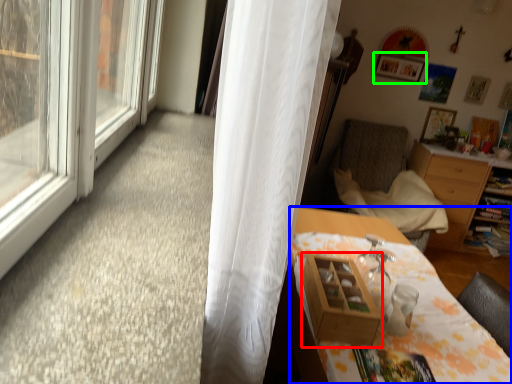
Question: Which object is positioned closest to shelf (highlighted by a red box)? Select from desk (highlighted by a blue box) and picture frame (highlighted by a green box).

Choices:
 (A) desk
 (B) picture frame

Answer: (A)